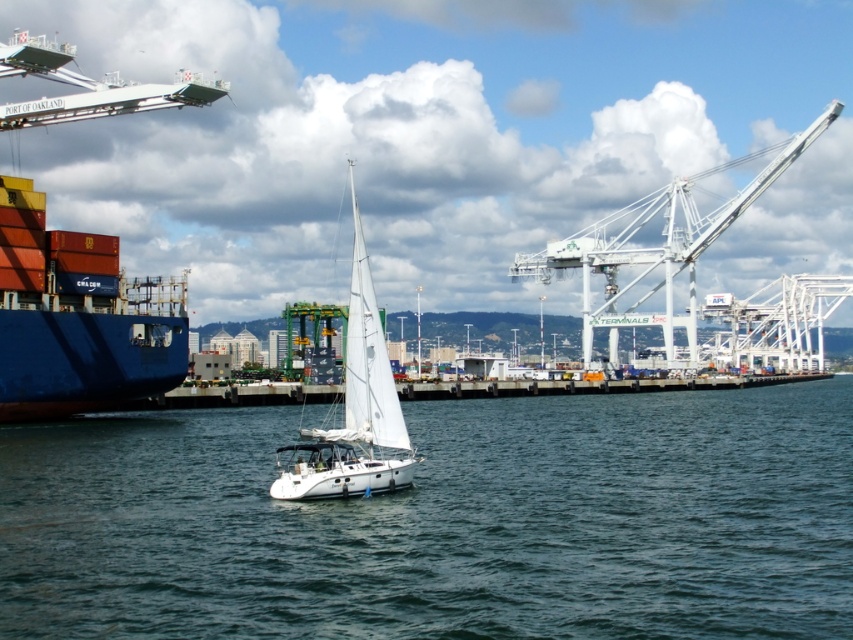
Is the position of clear blue water at center less distant than that of white metallic crane at upper right?

Yes, clear blue water at center is closer to the viewer.

Does point (213, 525) lie behind point (584, 252)?

No.

Where is `clear blue water at center`? The width and height of the screenshot is (853, 640). clear blue water at center is located at coordinates (444, 522).

Which is more to the left, clear blue water at center or white matte sailboat at center?

white matte sailboat at center

Is clear blue water at center above white matte sailboat at center?

No, clear blue water at center is not above white matte sailboat at center.

Describe the element at coordinates (444, 522) in the screenshot. The width and height of the screenshot is (853, 640). I see `clear blue water at center` at that location.

The image size is (853, 640). What are the coordinates of `clear blue water at center` in the screenshot? It's located at (444, 522).

Between white metallic crane at upper right and white matte sailboat at center, which one has less height?

Standing shorter between the two is white matte sailboat at center.

Where is `white metallic crane at upper right`? white metallic crane at upper right is located at coordinates (653, 250).